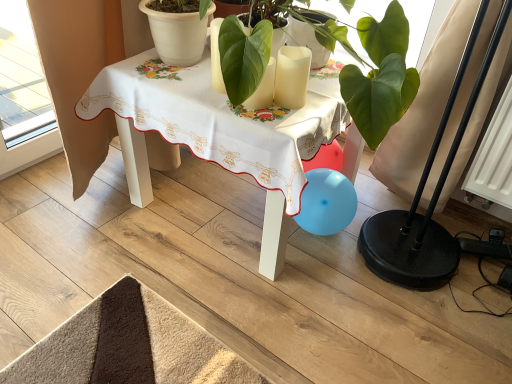
The height and width of the screenshot is (384, 512). Find the location of `free space to the right of white matte candle at center`. free space to the right of white matte candle at center is located at coordinates (324, 96).